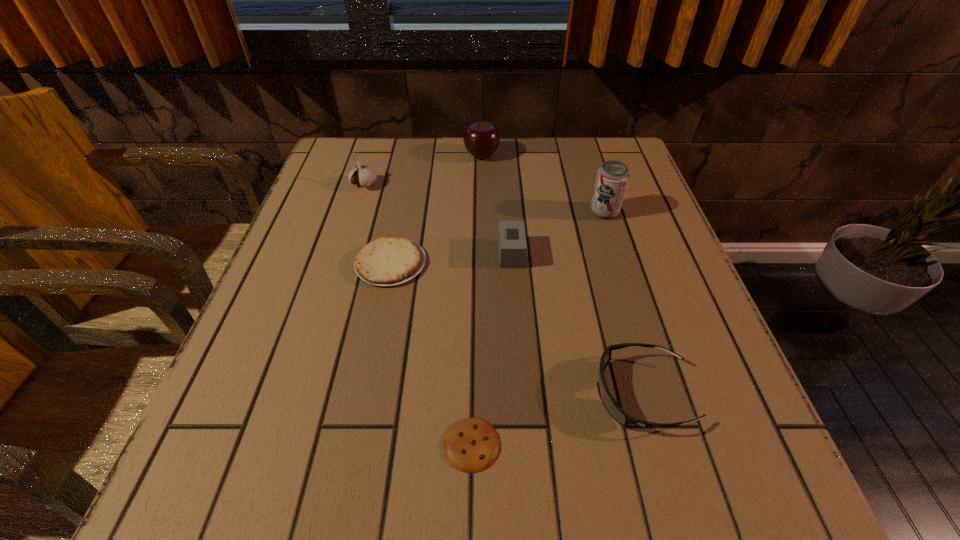
Find the location of a particular element. This screenshot has height=540, width=960. free region at the near edge of the desktop is located at coordinates (515, 463).

The height and width of the screenshot is (540, 960). Find the location of `vacant space at the left edge`. vacant space at the left edge is located at coordinates (266, 414).

Locate an element on the screen. free space at the right edge of the desktop is located at coordinates (645, 309).

In the image, there is a desktop. At what (x,y) coordinates should I click in order to perform the action: click on vacant space at the far left corner. Please return your answer as a coordinate pair (x, y). The width and height of the screenshot is (960, 540). Looking at the image, I should click on (348, 168).

I want to click on vacant space at the far right corner of the desktop, so click(578, 167).

At what (x,y) coordinates should I click in order to perform the action: click on free space between the tallest object and the tortilla. Please return your answer as a coordinate pair (x, y). The width and height of the screenshot is (960, 540). Looking at the image, I should click on (497, 238).

Identify the location of vacant point located between the goggles and the second shortest object. This screenshot has height=540, width=960. (516, 328).

Find the location of a particular element. Image resolution: width=960 pixels, height=540 pixels. free space that is in between the second farthest object and the goggles is located at coordinates (503, 289).

Where is `vacant area between the beer can and the shortest object`? The height and width of the screenshot is (540, 960). vacant area between the beer can and the shortest object is located at coordinates (539, 328).

Locate an element on the screen. The width and height of the screenshot is (960, 540). blank region between the tortilla and the apple is located at coordinates (436, 209).